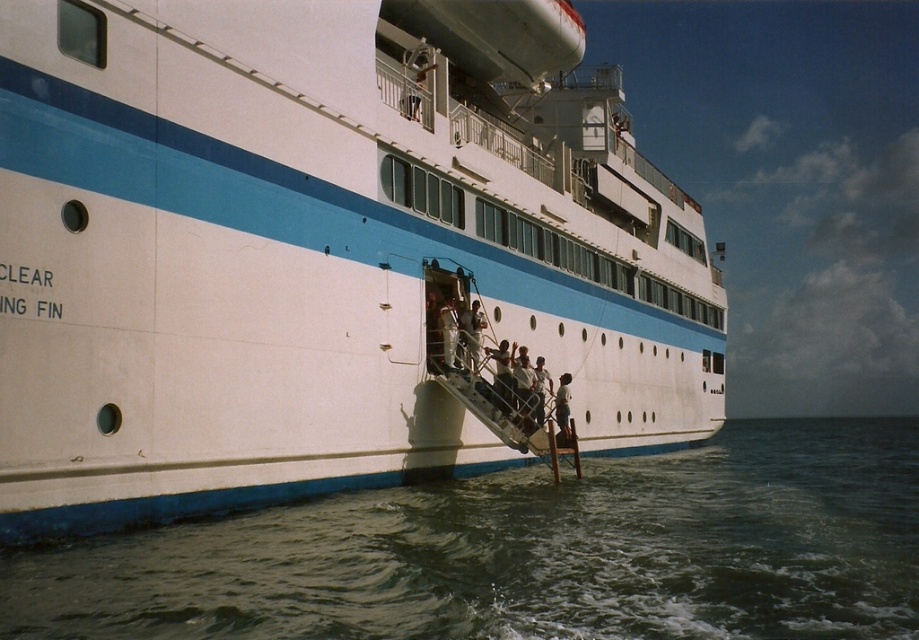
You are a fashion designer observing two shirts displayed at a store window. The shirts are the smooth white shirt at lower center and the light blue fabric shirt at lower center. Which shirt is taller in height?

The smooth white shirt at lower center has a greater height compared to the light blue fabric shirt at lower center.

You are a passenger on the cruise ship and want to choose between wearing the smooth white shirt at lower center and the light blue fabric shirt at lower center for a formal dinner. Which shirt would you recommend based on their sizes?

The smooth white shirt at lower center is larger in size than the light blue fabric shirt at lower center, so it would be more suitable for someone needing a bigger size.

You are standing on the cruise ship and want to move from point (303, 317) to point (454, 352). Which direction should you move to get closer to the ship?

Point (303, 317) is closer to the viewer than point (454, 352). To move closer to the ship, you should move towards point (303, 317).